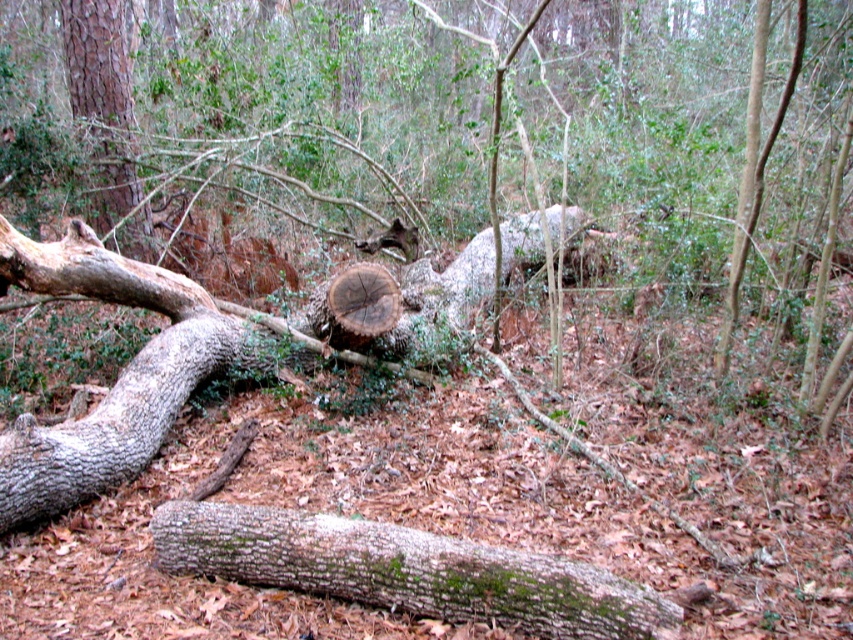
Is green mossy bark log at lower center positioned before smooth brown tree trunk at upper left?

Yes.

The image size is (853, 640). What do you see at coordinates (405, 570) in the screenshot?
I see `green mossy bark log at lower center` at bounding box center [405, 570].

Where is `green mossy bark log at lower center`? The image size is (853, 640). green mossy bark log at lower center is located at coordinates (405, 570).